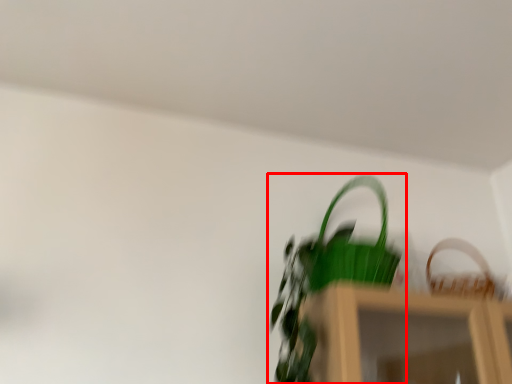
Question: Where is houseplant (annotated by the red box) located in relation to basket in the image?

Choices:
 (A) left
 (B) right

Answer: (A)